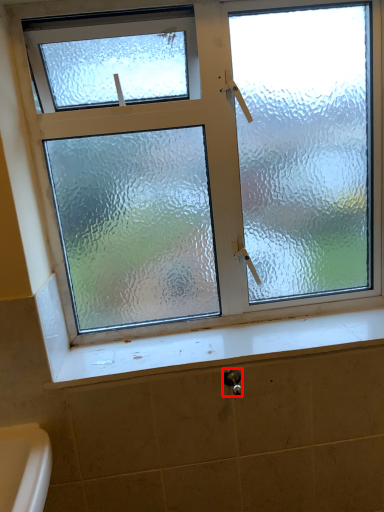
Question: From the image's perspective, what is the correct spatial relationship of shower (annotated by the red box) in relation to window sill?

Choices:
 (A) above
 (B) below

Answer: (B)